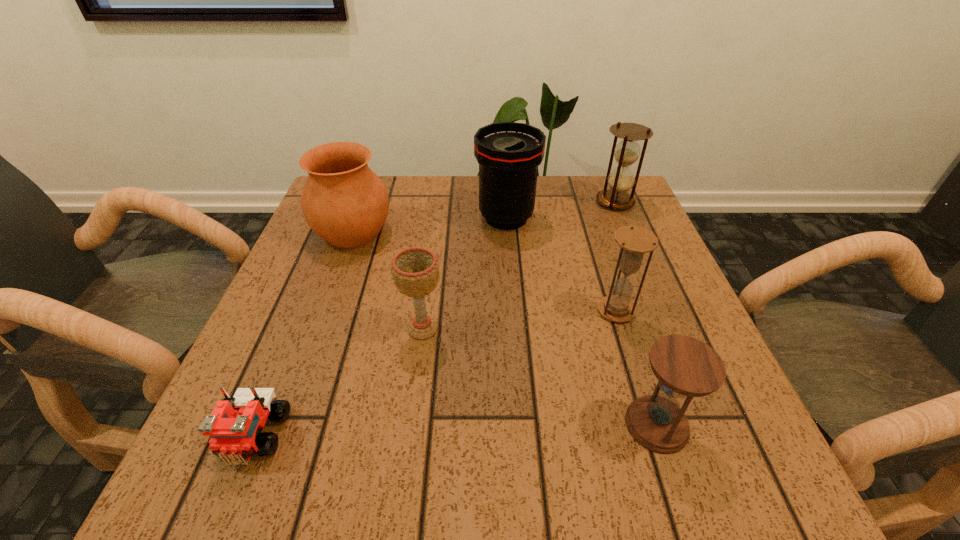
You are a GUI agent. You are given a task and a screenshot of the screen. Output one action in this format:
    pyautogui.click(x=<x>, y=<y>)
    Task: Click on the empty space that is in between the fourth object from left to right and the pottery
    Image resolution: width=960 pixels, height=540 pixels.
    Given the screenshot: What is the action you would take?
    pyautogui.click(x=429, y=225)

Find the location of a particular element. This screenshot has width=960, height=540. free space between the second nearest hourglass and the chalice is located at coordinates (519, 320).

You are a GUI agent. You are given a task and a screenshot of the screen. Output one action in this format:
    pyautogui.click(x=<x>, y=<y>)
    Task: Click on the blank region between the second farthest hourglass and the farthest hourglass
    The height and width of the screenshot is (540, 960).
    Given the screenshot: What is the action you would take?
    pyautogui.click(x=615, y=256)

The image size is (960, 540). I want to click on free area in between the chalice and the pottery, so click(x=388, y=280).

Where is `free space between the shortest hourglass and the second farthest hourglass`? This screenshot has height=540, width=960. free space between the shortest hourglass and the second farthest hourglass is located at coordinates (636, 368).

At what (x,y) coordinates should I click in order to perform the action: click on free spot between the telephoto lens and the pottery. Please return your answer as a coordinate pair (x, y). Image resolution: width=960 pixels, height=540 pixels. Looking at the image, I should click on (429, 225).

The image size is (960, 540). Identify the location of free spot between the second farthest hourglass and the farthest hourglass. (615, 256).

In order to click on the third closest object to the fourth object from left to right in this screenshot , I will do (x=634, y=241).

Point out which object is positioned as the fifth nearest to the farthest hourglass. Please provide its 2D coordinates. Your answer should be formatted as a tuple, i.e. [(x, y)], where the tuple contains the x and y coordinates of a point satisfying the conditions above.

[(686, 367)]

Find the location of a particular element. hourglass that stands as the second closest to the second farthest hourglass is located at coordinates (621, 179).